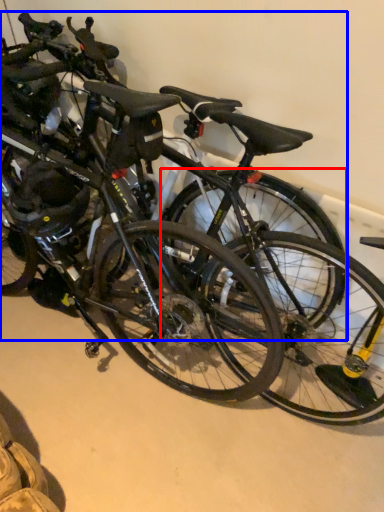
Question: Among these objects, which one is nearest to the camera, bicycle wheel (highlighted by a red box) or bicycle (highlighted by a blue box)?

Choices:
 (A) bicycle wheel
 (B) bicycle

Answer: (B)